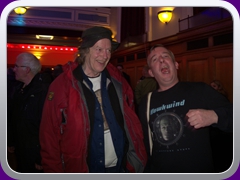
The height and width of the screenshot is (180, 240). What are the coordinates of `paneling` in the screenshot? It's located at pos(199,70).